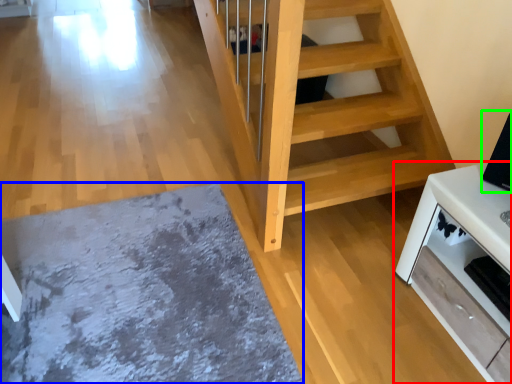
Question: Which object is positioned farthest from furniture (highlighted by a red box)? Select from mat (highlighted by a blue box) and appliance (highlighted by a green box).

Choices:
 (A) mat
 (B) appliance

Answer: (A)